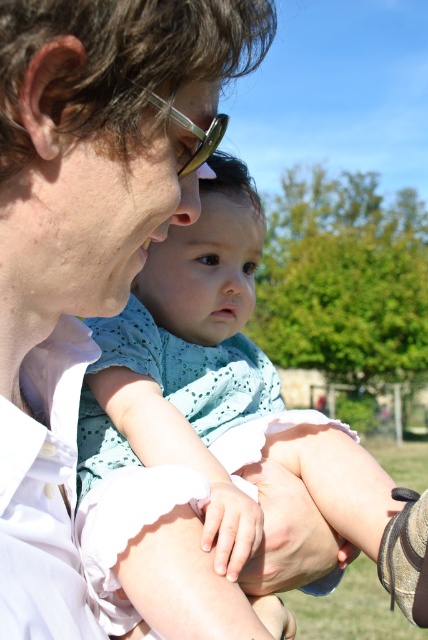
Does light blue fabric at center come behind pale skin hand at center?

Yes, it is.

From the picture: Does light blue fabric at center appear under pale skin hand at center?

No, light blue fabric at center is not below pale skin hand at center.

Is point (92, 378) positioned behind point (228, 490)?

Yes, point (92, 378) is farther from viewer.

Find the location of a particular element. This screenshot has width=428, height=640. light blue fabric at center is located at coordinates (168, 426).

Does matte white shirt at center have a greater width compared to light blue fabric at center?

Incorrect, matte white shirt at center's width does not surpass light blue fabric at center's.

Is matte white shirt at center bigger than light blue fabric at center?

Yes, matte white shirt at center is bigger than light blue fabric at center.

Does point (27, 257) come farther from viewer compared to point (142, 394)?

No, (27, 257) is in front of (142, 394).

What are the coordinates of `matte white shirt at center` in the screenshot? It's located at (101, 147).

Can you confirm if light blue fabric dress at center is shorter than pale skin hand at center?

No.

Locate an element on the screen. This screenshot has width=428, height=640. light blue fabric dress at center is located at coordinates (217, 404).